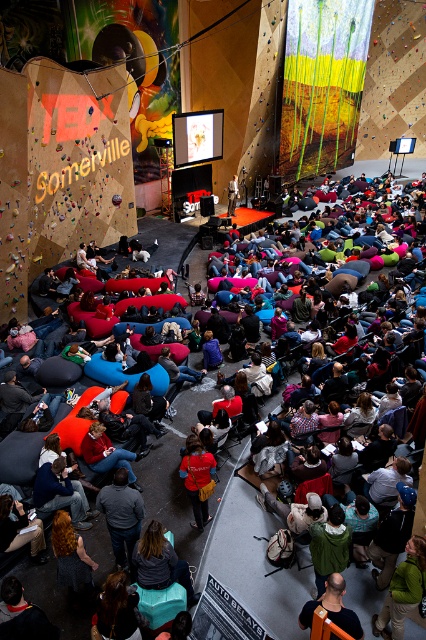
Question: Is red matte shirt at center in front of matte black laptop at center?

Choices:
 (A) no
 (B) yes

Answer: (B)

Question: Which object is positioned closest to the dark brown leather jacket at lower center?

Choices:
 (A) red matte shirt at center
 (B) matte black laptop at center

Answer: (A)

Question: Which point is farther to the camera?

Choices:
 (A) red matte shirt at center
 (B) dark blue fabric seat at center
 (C) matte black laptop at center
 (D) dark brown leather jacket at lower center

Answer: (C)

Question: Which of the following is the farthest from the observer?

Choices:
 (A) (187, 477)
 (B) (175, 454)
 (C) (345, 624)

Answer: (B)

Question: Does dark brown leather jacket at lower center appear on the left side of matte black laptop at center?

Choices:
 (A) yes
 (B) no

Answer: (B)

Question: Can you confirm if dark blue fabric seat at center is wider than red matte shirt at center?

Choices:
 (A) no
 (B) yes

Answer: (B)